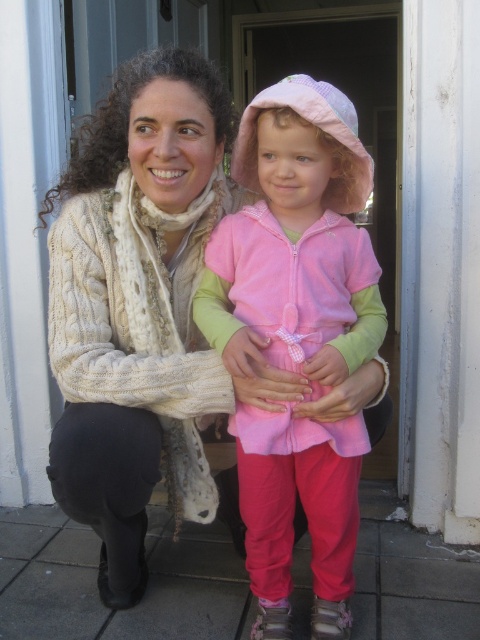
Question: Can you confirm if white cable-knit sweater at center is thinner than pink fleece jacket at center?

Choices:
 (A) yes
 (B) no

Answer: (B)

Question: Which object is closer to the camera taking this photo?

Choices:
 (A) white cable-knit sweater at center
 (B) pink fleece jacket at center

Answer: (B)

Question: Observing the image, what is the correct spatial positioning of white cable-knit sweater at center in reference to pink fleece jacket at center?

Choices:
 (A) left
 (B) right

Answer: (A)

Question: Can you confirm if white cable-knit sweater at center is smaller than pink fleece jacket at center?

Choices:
 (A) yes
 (B) no

Answer: (B)

Question: Which object is closer to the camera taking this photo?

Choices:
 (A) white cable-knit sweater at center
 (B) pink fleece jacket at center

Answer: (B)